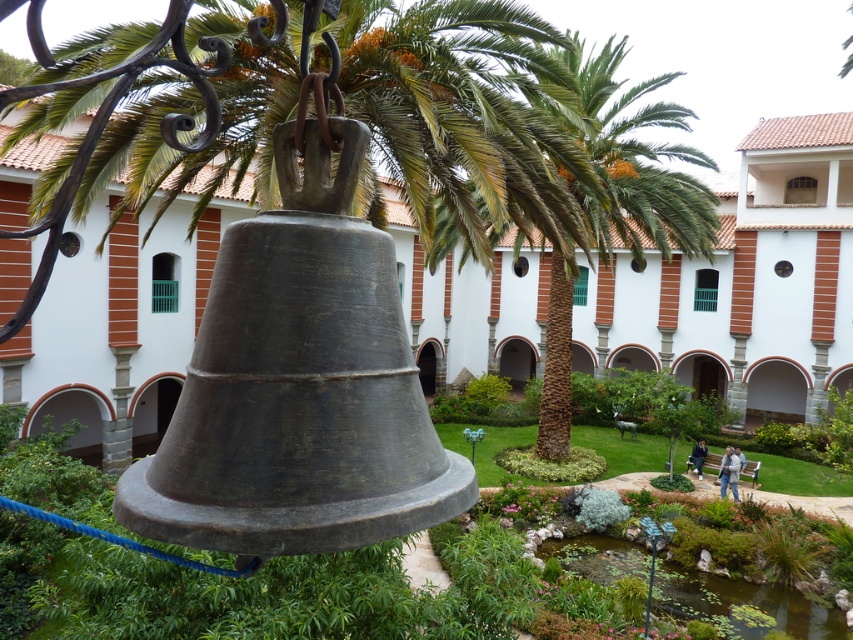
You are standing at the entrance of the garden and see two points in the image. The first point is labeled as point (548, 298) and the second is point (728, 614). Which point is closer to you?

Point (728, 614) is closer to you because the point (548, 298) is behind it.

You are a gardener who wants to plant a new flower bed between the green leafy palm tree at center and the green lily pads at lower center. Which side of the flower bed should be wider to match the widths of the existing plants?

The green leafy palm tree at center is wider than the green lily pads at lower center, so the side of the flower bed near the green leafy palm tree at center should be wider to match its width.

You are standing in the garden and want to place a small statue between the green leafy palm tree at center and the green lily pads at lower center. Which direction should you place it so that it is closer to the taller object?

The green leafy palm tree at center is taller than the green lily pads at lower center. To place the statue closer to the taller object, you should position it nearer to the green leafy palm tree at center.